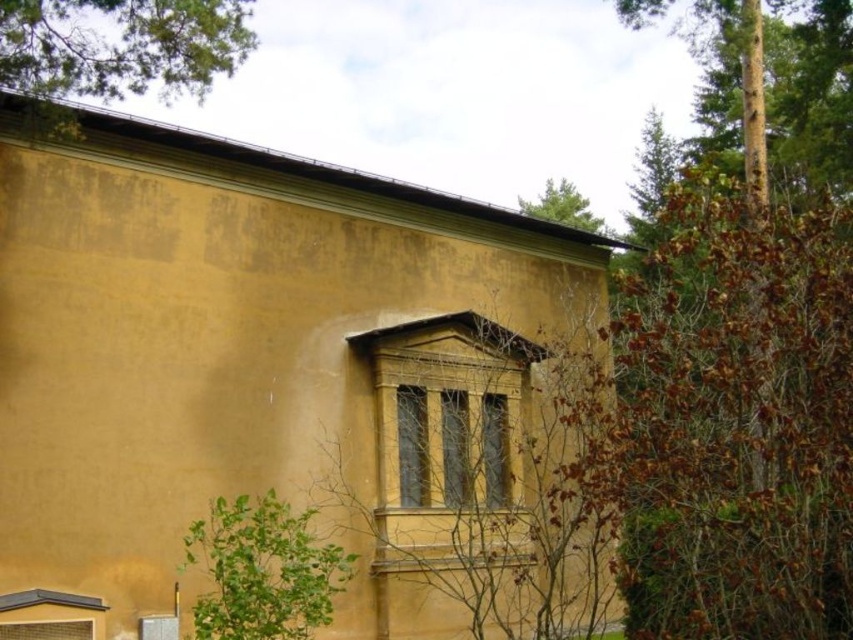
Does brown rough bark tree at upper right appear on the left side of green leafy tree at upper left?

No, brown rough bark tree at upper right is not to the left of green leafy tree at upper left.

Is point (842, 76) closer to viewer compared to point (120, 61)?

No, (842, 76) is behind (120, 61).

The height and width of the screenshot is (640, 853). What are the coordinates of `brown rough bark tree at upper right` in the screenshot? It's located at (779, 86).

Who is shorter, green leafy tree at upper left or green leafy tree at upper center?

Standing shorter between the two is green leafy tree at upper left.

Does green leafy tree at upper left have a greater height compared to green leafy tree at upper center?

No, green leafy tree at upper left is not taller than green leafy tree at upper center.

Is point (163, 83) more distant than point (573, 184)?

No, it is in front of (573, 184).

Image resolution: width=853 pixels, height=640 pixels. What are the coordinates of `green leafy tree at upper left` in the screenshot? It's located at (115, 51).

Does green leafy tree at lower left have a smaller size compared to green leafy tree at upper center?

Yes, green leafy tree at lower left is smaller than green leafy tree at upper center.

Which of these two, green leafy tree at lower left or green leafy tree at upper center, stands shorter?

green leafy tree at lower left is shorter.

Where is `green leafy tree at lower left`? green leafy tree at lower left is located at coordinates (262, 570).